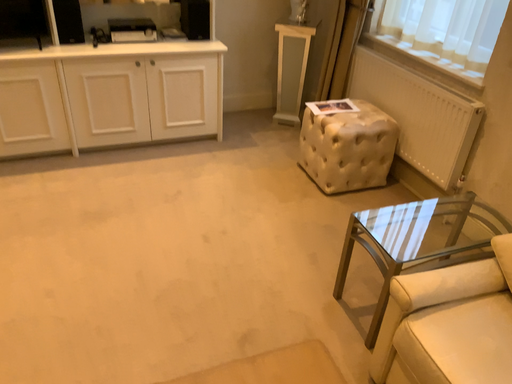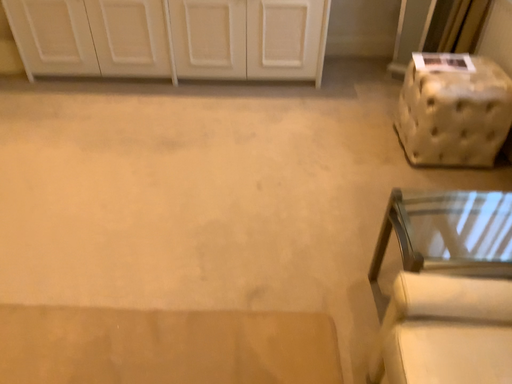
Question: How did the camera likely rotate when shooting the video?

Choices:
 (A) rotated right
 (B) rotated left

Answer: (B)